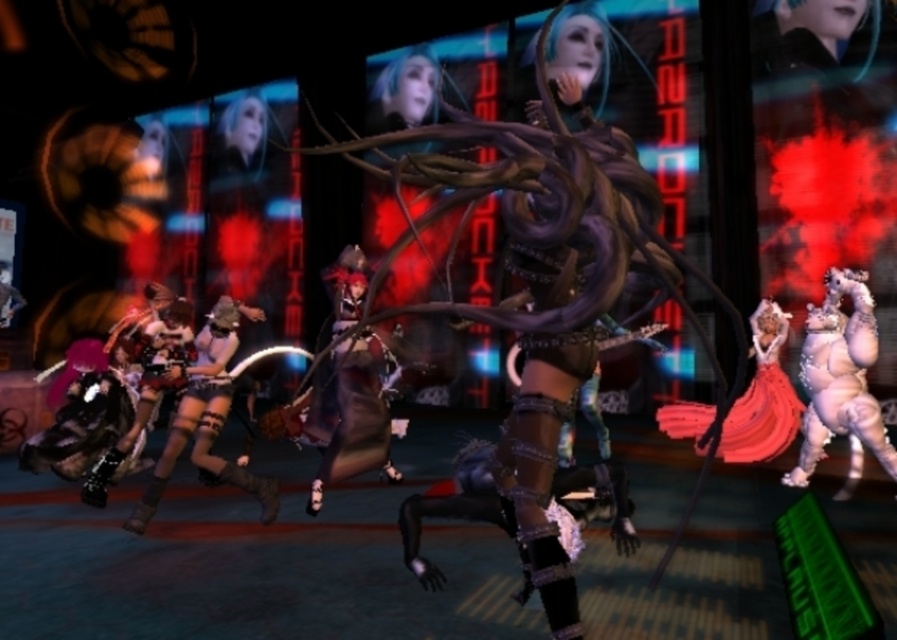
Question: In this image, where is pink flesh-colored figure at right located relative to shiny metallic armor at lower left?

Choices:
 (A) above
 (B) below

Answer: (B)

Question: Which of the following is the farthest from the observer?

Choices:
 (A) shiny metallic armor at lower left
 (B) shiny satin dress at right
 (C) pink flesh-colored figure at right
 (D) shiny black armor at center

Answer: (B)

Question: Is shiny black armor at center thinner than shiny satin dress at right?

Choices:
 (A) no
 (B) yes

Answer: (B)

Question: Which point is farther to the camera?

Choices:
 (A) (381, 444)
 (B) (819, 314)
 (C) (213, 323)

Answer: (B)

Question: Which point is farther to the camera?

Choices:
 (A) (764, 424)
 (B) (858, 419)
 (C) (359, 352)
 (D) (257, 486)

Answer: (A)

Question: Does shiny black armor at center have a greater width compared to shiny metallic armor at lower left?

Choices:
 (A) yes
 (B) no

Answer: (B)